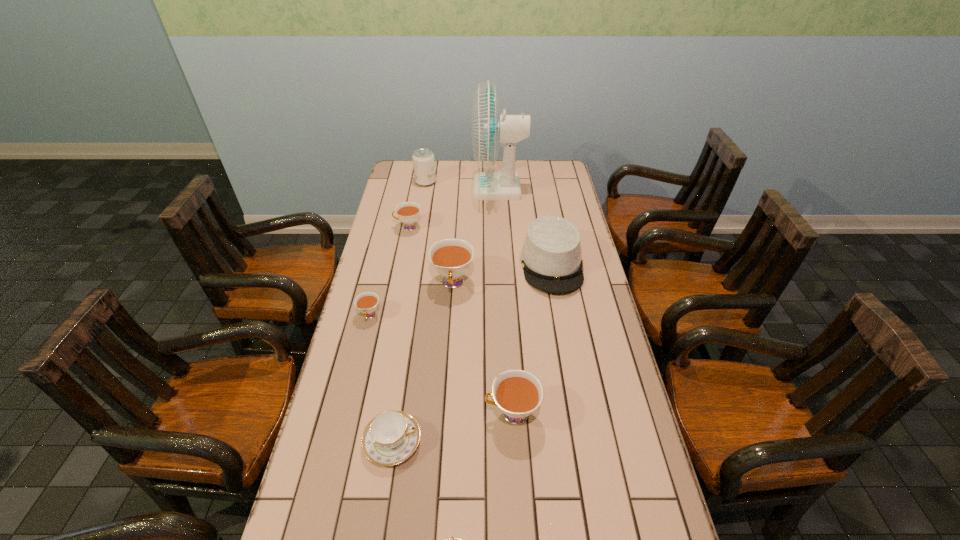
Where is `vacant space positioned 0.240m on the side of the second tallest teacup with the handle`? The image size is (960, 540). vacant space positioned 0.240m on the side of the second tallest teacup with the handle is located at coordinates (396, 414).

At what (x,y) coordinates should I click in order to perform the action: click on vacant space located 0.340m on the side of the second tallest teacup with the handle. Please return your answer as a coordinate pair (x, y). Image resolution: width=960 pixels, height=540 pixels. Looking at the image, I should click on (360, 414).

Where is `free space located 0.170m on the side of the second tallest teacup with the handle`? Image resolution: width=960 pixels, height=540 pixels. free space located 0.170m on the side of the second tallest teacup with the handle is located at coordinates click(x=422, y=414).

Where is `free point located 0.110m on the side with the handle of the farther blue teacup`? free point located 0.110m on the side with the handle of the farther blue teacup is located at coordinates (464, 442).

Where is `free space located on the side of the third farthest white teacup with the handle`? This screenshot has height=540, width=960. free space located on the side of the third farthest white teacup with the handle is located at coordinates (354, 378).

Find the location of a particular element. fan that is at the far edge is located at coordinates (488, 128).

What are the coordinates of `soda can located in the far edge section of the desktop` in the screenshot? It's located at (423, 159).

Locate an element on the screen. The height and width of the screenshot is (540, 960). soda can located at the left edge is located at coordinates (423, 159).

You are a GUI agent. You are given a task and a screenshot of the screen. Output one action in this format:
    pyautogui.click(x=<x>, y=<y>)
    Task: Click on the object present at the right edge
    
    Given the screenshot: What is the action you would take?
    pyautogui.click(x=551, y=255)

Identify the location of object at the far left corner. (423, 159).